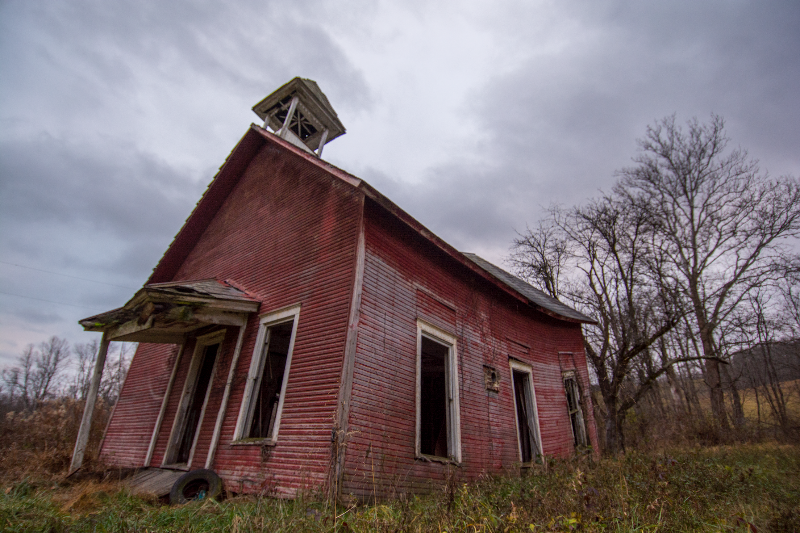
Image resolution: width=800 pixels, height=533 pixels. I want to click on window, so click(x=265, y=395), click(x=440, y=401), click(x=521, y=414).